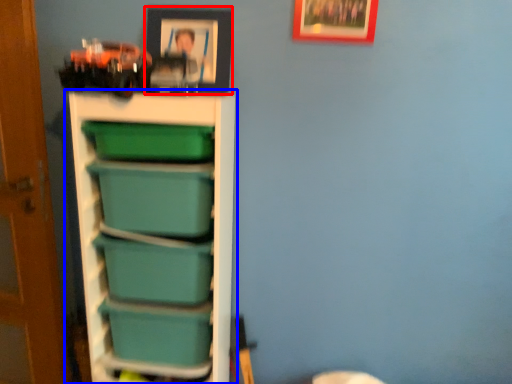
Question: Which of the following is the closest to the observer, picture frame (highlighted by a red box) or shelf (highlighted by a blue box)?

Choices:
 (A) picture frame
 (B) shelf

Answer: (B)